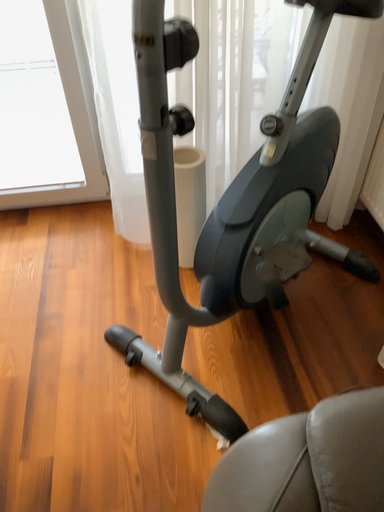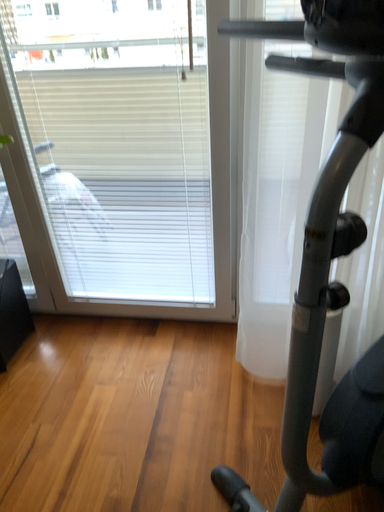
Question: How did the camera likely rotate when shooting the video?

Choices:
 (A) rotated downward
 (B) rotated upward

Answer: (B)